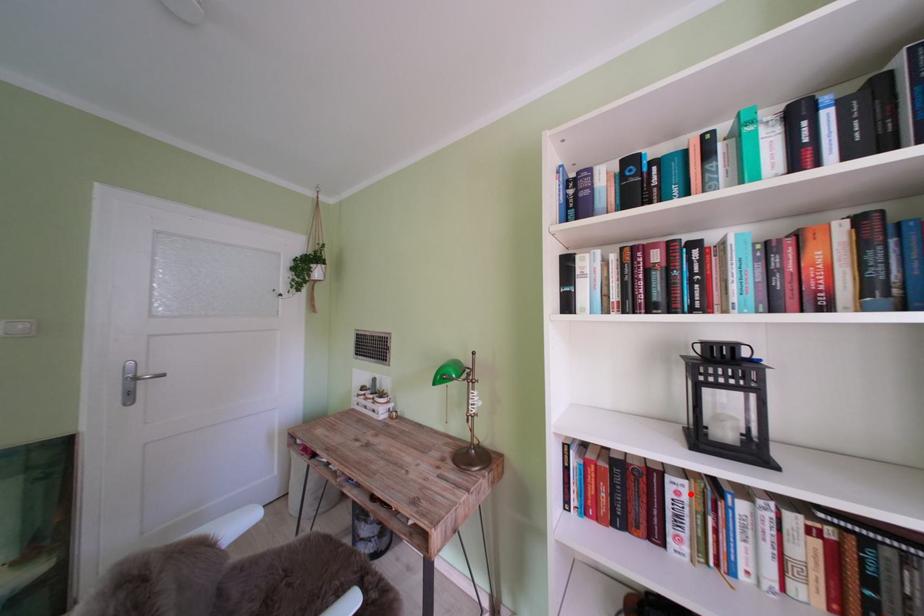
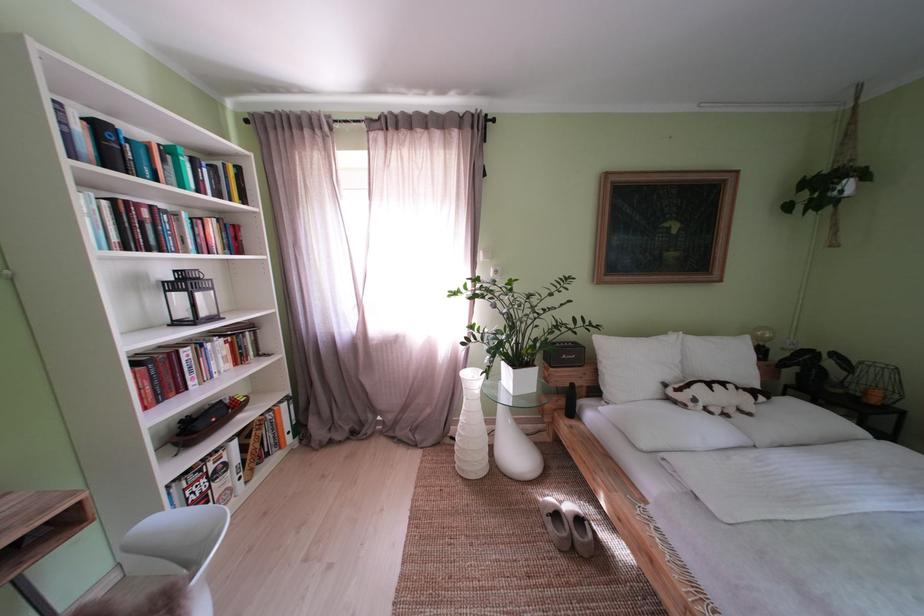
In the second image, find the point that corresponds to the highlighted location in the first image.

(199, 359)